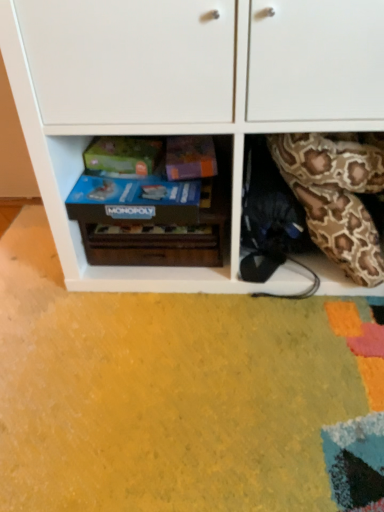
Where is `vacant space situated on the left part of wooden monopoly game at center`? The width and height of the screenshot is (384, 512). vacant space situated on the left part of wooden monopoly game at center is located at coordinates (38, 289).